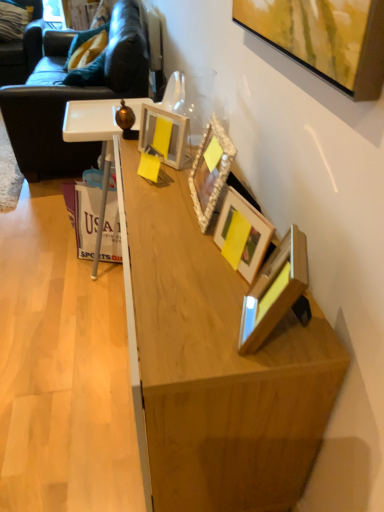
The width and height of the screenshot is (384, 512). Identify the location of free point behind wooden picture frame at lower right, which appears as the fourth picture frame when viewed from the back. (240, 278).